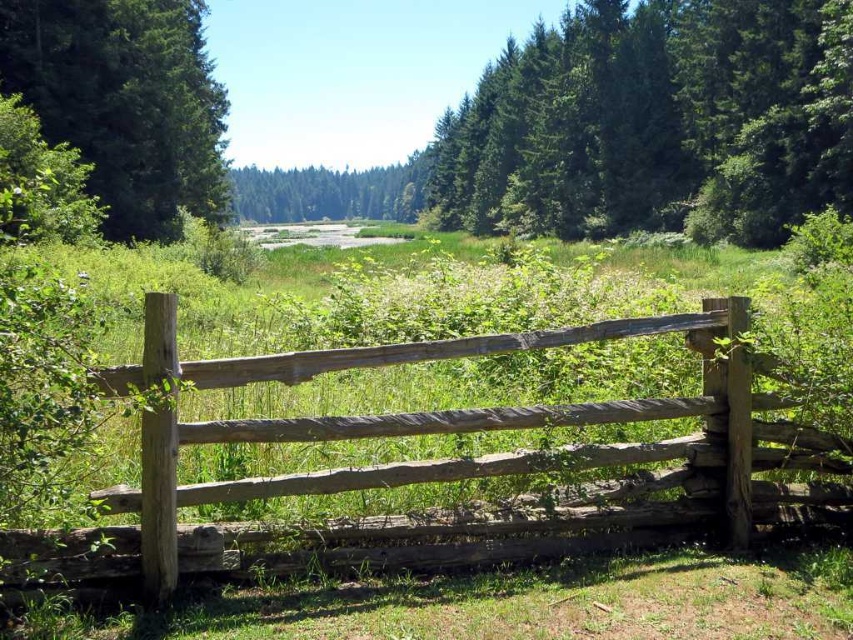
You are a park ranger planning to install a new bench between the green textured tree at upper center and the green matte tree at center. The bench requires a minimum of 30 meters of space between the two trees to be placed safely. Can you place the bench there?

The distance between the green textured tree at upper center and the green matte tree at center is 42.05 meters, which exceeds the required 30 meters. Therefore, the bench can be safely placed there.

You are planning to install a new garden path that needs to pass through the weathered wood fence at center and the green matte tree at center. Based on their sizes, which object will require more adjustments to accommodate the path?

The green matte tree at center will require more adjustments because it occupies more space than the weathered wood fence at center.

You are standing in the meadow and want to take a photo of both the weathered wood fence at center and the green matte tree at center. Which object should you move towards if you want to include both in your frame without moving the camera?

You should move towards the green matte tree at center because the weathered wood fence at center is on the right side of it, so positioning yourself closer to the tree will allow both objects to be in the frame without needing to adjust the camera angle.